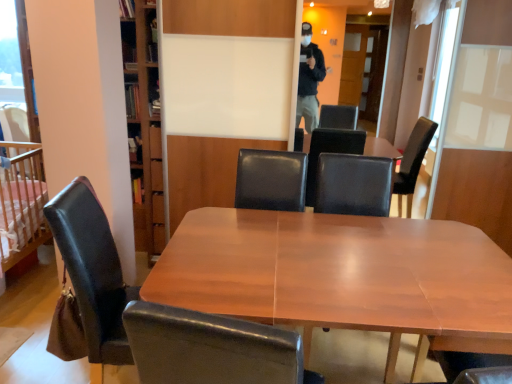
Question: Considering the relative positions of wooden crib at left and wooden table at center in the image provided, is wooden crib at left to the right of wooden table at center from the viewer's perspective?

Choices:
 (A) yes
 (B) no

Answer: (B)

Question: Considering the relative sizes of wooden crib at left and wooden table at center in the image provided, is wooden crib at left smaller than wooden table at center?

Choices:
 (A) no
 (B) yes

Answer: (B)

Question: Is wooden crib at left bigger than wooden table at center?

Choices:
 (A) no
 (B) yes

Answer: (A)

Question: From a real-world perspective, is wooden crib at left physically above wooden table at center?

Choices:
 (A) yes
 (B) no

Answer: (A)

Question: From the image's perspective, would you say wooden crib at left is shown under wooden table at center?

Choices:
 (A) no
 (B) yes

Answer: (A)

Question: Is wooden crib at left positioned with its back to wooden table at center?

Choices:
 (A) yes
 (B) no

Answer: (B)

Question: Is leather at left, which is counted as the first chair, starting from the front, positioned with its back to black leather armchair at center?

Choices:
 (A) no
 (B) yes

Answer: (A)

Question: Considering the relative positions of leather at left, marked as the second chair in a left-to-right arrangement, and black leather armchair at center in the image provided, is leather at left, marked as the second chair in a left-to-right arrangement, behind black leather armchair at center?

Choices:
 (A) yes
 (B) no

Answer: (B)

Question: Can you confirm if leather at left, marked as the second chair in a left-to-right arrangement, is wider than black leather armchair at center?

Choices:
 (A) no
 (B) yes

Answer: (B)

Question: Is black leather armchair at center completely or partially inside leather at left, the 1th chair when ordered from right to left?

Choices:
 (A) no
 (B) yes

Answer: (A)

Question: From the image's perspective, is leather at left, which is counted as the first chair, starting from the front, below black leather armchair at center?

Choices:
 (A) yes
 (B) no

Answer: (A)

Question: Considering the relative sizes of leather at left, the 1th chair when ordered from right to left, and black leather armchair at center in the image provided, is leather at left, the 1th chair when ordered from right to left, smaller than black leather armchair at center?

Choices:
 (A) no
 (B) yes

Answer: (A)

Question: From the image's perspective, is black leather armchair at center above leather at left, the 1th chair when ordered from right to left?

Choices:
 (A) no
 (B) yes

Answer: (B)